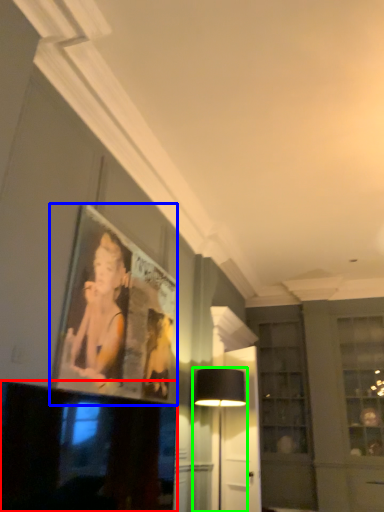
Question: Which is farther away from television (highlighted by a red box)? picture frame (highlighted by a blue box) or table lamp (highlighted by a green box)?

Choices:
 (A) picture frame
 (B) table lamp

Answer: (B)